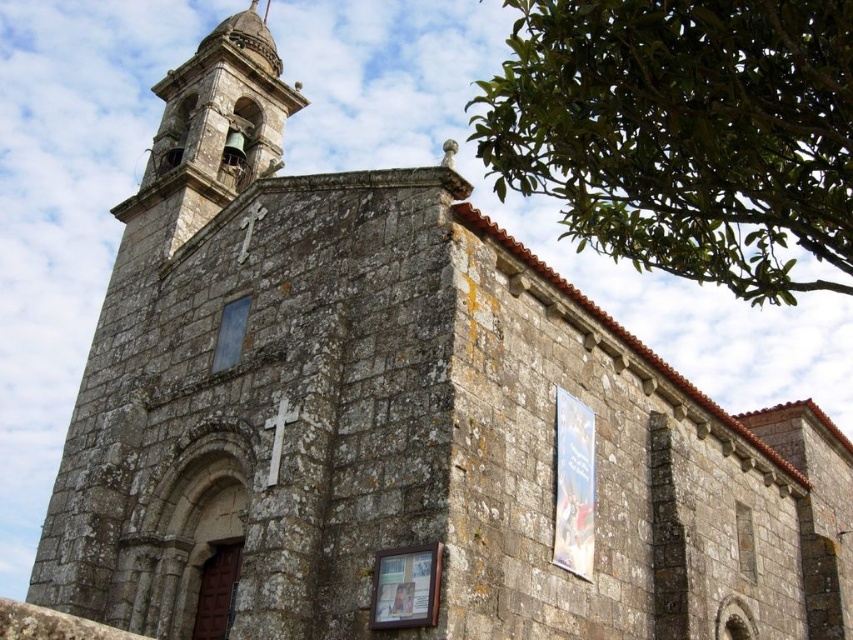
You are standing in front of the church and want to take a photo that includes both the green leafy tree at upper right and the rusty stone bell tower at upper left. Based on their positions, which one should you adjust your camera angle to focus on first to ensure both are in frame?

The green leafy tree at upper right is positioned on the right side of the rusty stone bell tower at upper left, so you should adjust your camera angle to focus on the rusty stone bell tower at upper left first to ensure both are in frame.

You are standing in front of the stone church and notice two points marked on the image. One is at coordinates point (822, 13) and the other is at point (169, 140). Which point is closer to your current position?

Point (822, 13) is closer to the camera than point (169, 140), so the point at coordinates point (822, 13) is closer to your current position.

You are standing in front of the church and want to take a photo of the bell tower. There is a green leafy tree at upper right in the background. Where should you position yourself to ensure the tree doesn not block the view of the bell tower?

To avoid the green leafy tree at upper right blocking the bell tower, position yourself to the left side of the church, as the tree is located at the upper right corner, which is opposite to the bell tower on the left side.